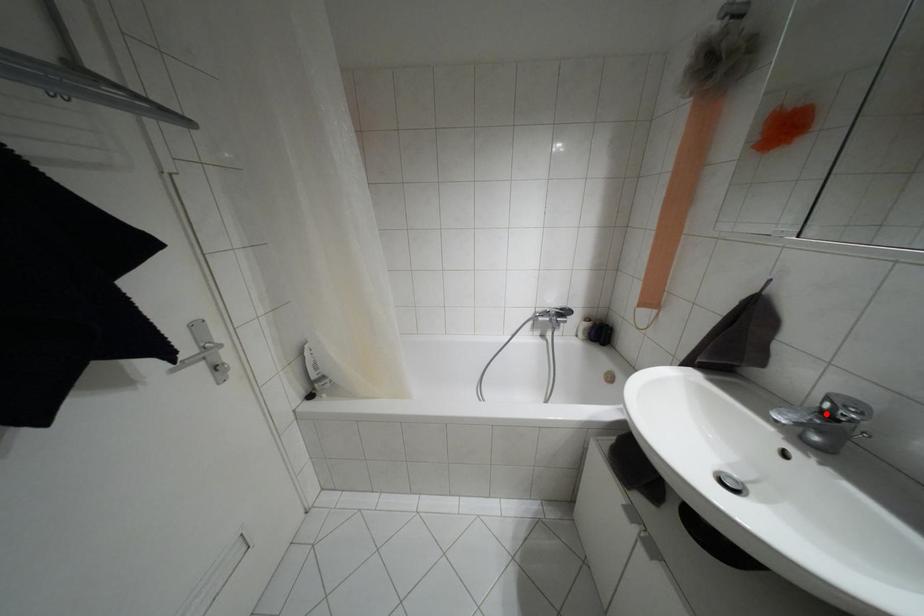
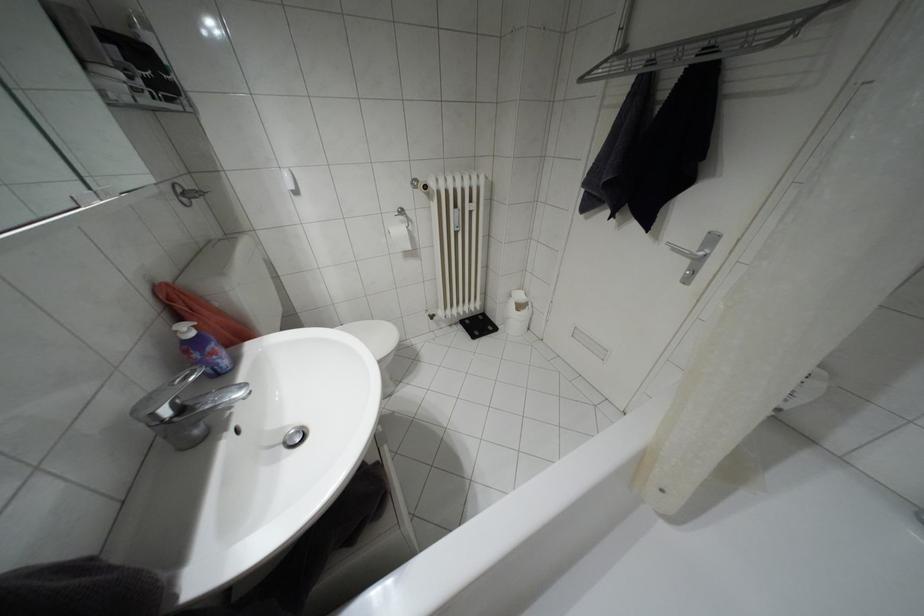
In the second image, find the point that corresponds to the highlighted location in the first image.

(180, 408)